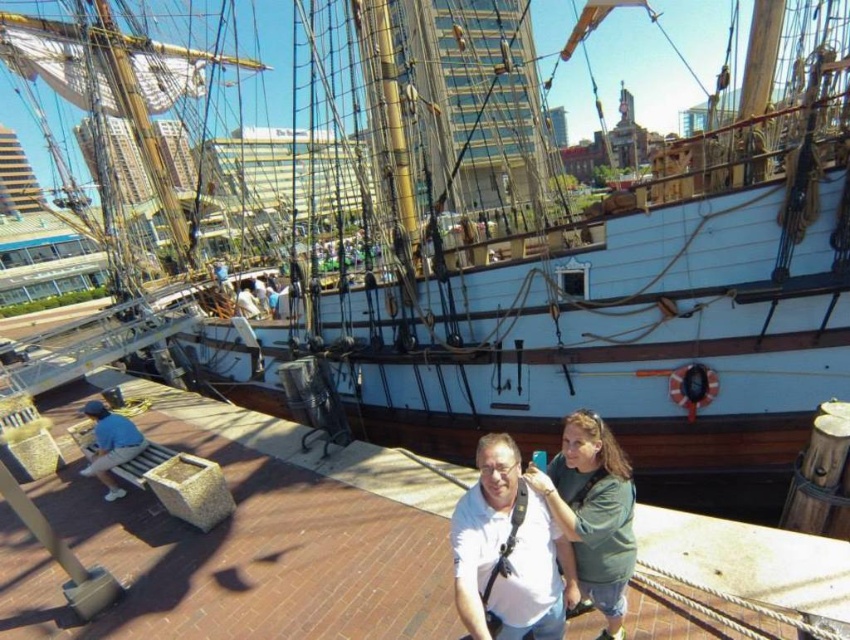
Question: Which point is farther to the camera?

Choices:
 (A) (625, 563)
 (B) (110, 468)
 (C) (460, 557)

Answer: (B)

Question: Is green matte shirt at center to the right of blue denim shorts at lower left from the viewer's perspective?

Choices:
 (A) yes
 (B) no

Answer: (A)

Question: Which point is closer to the camera?

Choices:
 (A) (119, 419)
 (B) (484, 634)
 (C) (588, 573)

Answer: (B)

Question: Can you confirm if white matte shirt at center is positioned above blue denim shorts at lower left?

Choices:
 (A) yes
 (B) no

Answer: (B)

Question: Can you confirm if green matte shirt at center is positioned above blue denim shorts at lower left?

Choices:
 (A) no
 (B) yes

Answer: (B)

Question: Estimate the real-world distances between objects in this image. Which object is farther from the green matte shirt at center?

Choices:
 (A) blue denim shorts at lower left
 (B) white matte shirt at center

Answer: (A)